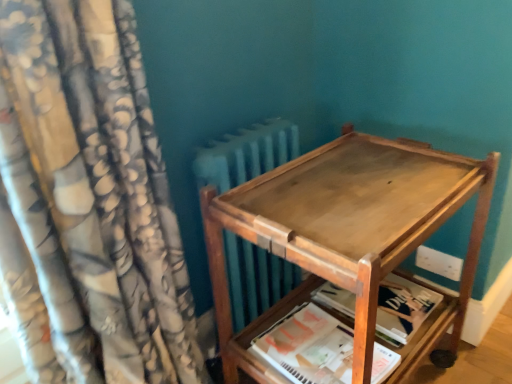
Question: Considering the relative sizes of white paper at lower center, the second paperback book when ordered from back to front, and wooden paperback book at lower right, the first paperback book viewed from the back, in the image provided, is white paper at lower center, the second paperback book when ordered from back to front, bigger than wooden paperback book at lower right, the first paperback book viewed from the back,?

Choices:
 (A) no
 (B) yes

Answer: (A)

Question: Would you say white paper at lower center, the second paperback book when ordered from back to front, is outside wooden paperback book at lower right, the first paperback book viewed from the back?

Choices:
 (A) yes
 (B) no

Answer: (A)

Question: Is white paper at lower center, marked as the 1th paperback book in a front-to-back arrangement, next to wooden paperback book at lower right, which is the second paperback book in front-to-back order?

Choices:
 (A) yes
 (B) no

Answer: (B)

Question: From a real-world perspective, is white paper at lower center, marked as the 1th paperback book in a front-to-back arrangement, located beneath wooden paperback book at lower right, the first paperback book viewed from the back?

Choices:
 (A) no
 (B) yes

Answer: (A)

Question: Is wooden paperback book at lower right, which is the second paperback book in front-to-back order, at the back of white paper at lower center, the second paperback book when ordered from back to front?

Choices:
 (A) no
 (B) yes

Answer: (A)

Question: From the image's perspective, is floral fabric curtain at left located above or below wooden tray at center?

Choices:
 (A) above
 (B) below

Answer: (A)

Question: In terms of width, does floral fabric curtain at left look wider or thinner when compared to wooden tray at center?

Choices:
 (A) thin
 (B) wide

Answer: (B)

Question: In the image, is floral fabric curtain at left positioned in front of or behind wooden tray at center?

Choices:
 (A) front
 (B) behind

Answer: (A)

Question: Is floral fabric curtain at left taller or shorter than wooden tray at center?

Choices:
 (A) tall
 (B) short

Answer: (A)

Question: In terms of width, does floral fabric curtain at left look wider or thinner when compared to wooden paperback book at lower right, which is the second paperback book in front-to-back order?

Choices:
 (A) thin
 (B) wide

Answer: (B)

Question: In terms of height, does floral fabric curtain at left look taller or shorter compared to wooden paperback book at lower right, the first paperback book viewed from the back?

Choices:
 (A) short
 (B) tall

Answer: (B)

Question: Is floral fabric curtain at left spatially inside wooden paperback book at lower right, which is the second paperback book in front-to-back order, or outside of it?

Choices:
 (A) inside
 (B) outside

Answer: (B)

Question: From a real-world perspective, is floral fabric curtain at left positioned above or below wooden paperback book at lower right, the first paperback book viewed from the back?

Choices:
 (A) below
 (B) above

Answer: (B)

Question: Is white paper at lower center, the second paperback book when ordered from back to front, inside the boundaries of floral fabric curtain at left, or outside?

Choices:
 (A) inside
 (B) outside

Answer: (B)

Question: Considering the positions of white paper at lower center, the second paperback book when ordered from back to front, and floral fabric curtain at left in the image, is white paper at lower center, the second paperback book when ordered from back to front, taller or shorter than floral fabric curtain at left?

Choices:
 (A) short
 (B) tall

Answer: (A)